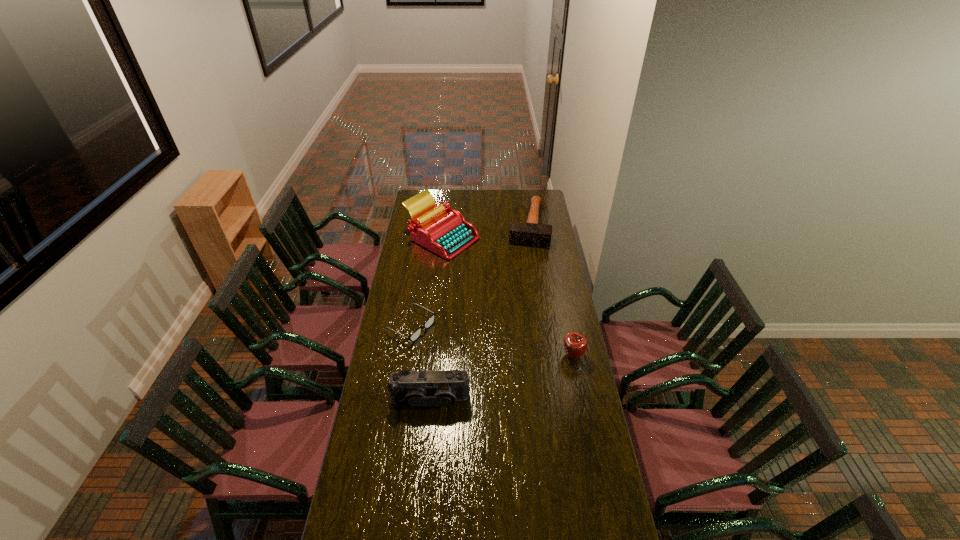
Identify the location of free space on the desktop that is between the nearest object and the third shortest object and is positioned on the striking face of the fourth tallest object. (500, 378).

The image size is (960, 540). What are the coordinates of `free space on the desktop that is between the nearest object and the third tallest object and is positioned on the front-facing side of the shortest object` in the screenshot? It's located at (503, 377).

Where is `free spot on the desktop that is between the camcorder and the third tallest object and is positioned on the typing side of the typewriter`? The height and width of the screenshot is (540, 960). free spot on the desktop that is between the camcorder and the third tallest object and is positioned on the typing side of the typewriter is located at coordinates (516, 373).